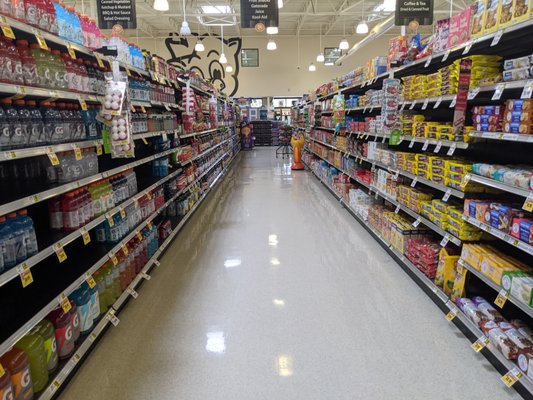
Locate an element on the screen. Image resolution: width=533 pixels, height=400 pixels. white dome shaped overhead lights is located at coordinates (270, 46), (269, 32), (310, 68), (321, 58), (344, 44), (359, 26), (161, 9).